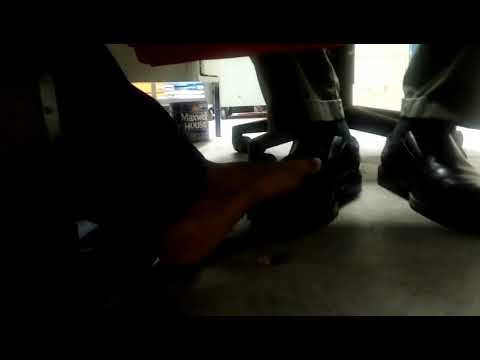
Where is `chair leg`? chair leg is located at coordinates (264, 138), (264, 123), (372, 114), (387, 111).